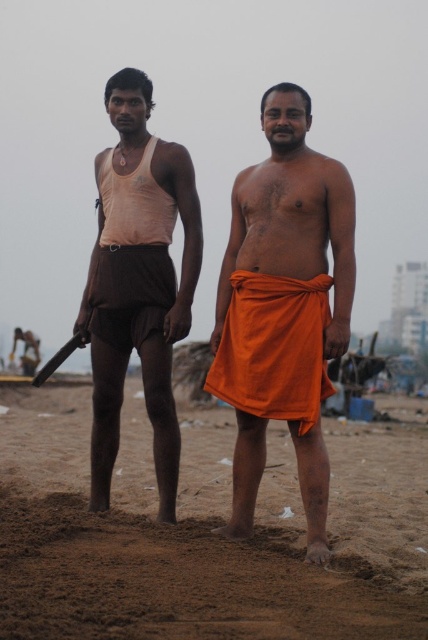
Question: Among these objects, which one is nearest to the camera?

Choices:
 (A) orange cloth at center
 (B) brown sandy feet at lower center
 (C) matte brown shorts at left

Answer: (B)

Question: Which point is farther from the camera taking this photo?

Choices:
 (A) (300, 440)
 (B) (112, 312)

Answer: (B)

Question: Can you confirm if brown sandy feet at lower center is positioned to the right of orange cloth at center?

Choices:
 (A) no
 (B) yes

Answer: (B)

Question: From the image, what is the correct spatial relationship of orange cloth at center in relation to matte brown shorts at left?

Choices:
 (A) left
 (B) right

Answer: (B)

Question: Which of the following is the farthest from the observer?

Choices:
 (A) (29, 394)
 (B) (315, 384)
 (C) (160, 339)

Answer: (A)

Question: Is brown sandy feet at lower center further to camera compared to matte brown shorts at left?

Choices:
 (A) no
 (B) yes

Answer: (A)